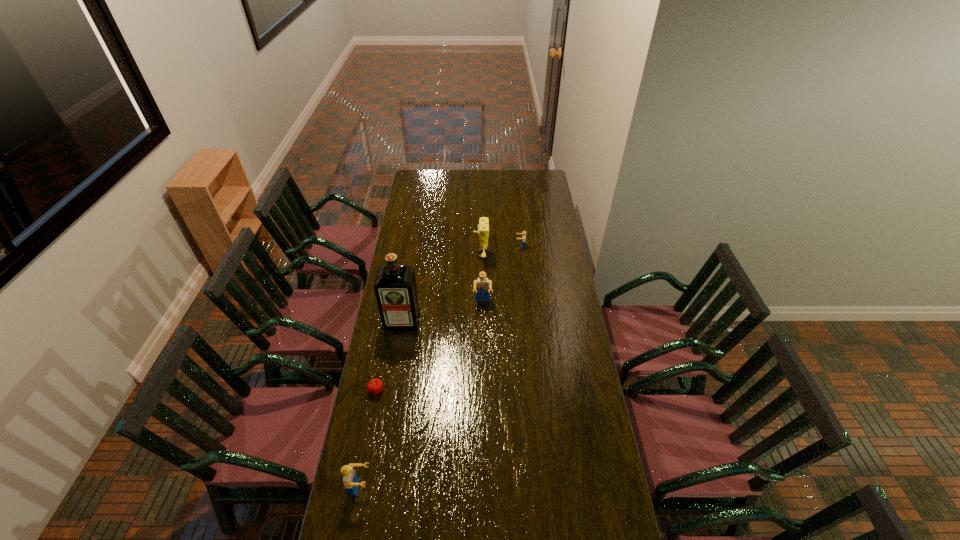
Locate an element on the screen. This screenshot has width=960, height=540. free space between the fourth tallest object and the second tallest object is located at coordinates (420, 371).

Locate an element on the screen. This screenshot has height=540, width=960. free space between the third nearest object and the fifth farthest object is located at coordinates (389, 355).

Where is `vacant point located between the rightmost Lego and the cherry`? This screenshot has height=540, width=960. vacant point located between the rightmost Lego and the cherry is located at coordinates (448, 318).

Locate an element on the screen. The width and height of the screenshot is (960, 540). empty location between the second nearest object and the second farthest Lego is located at coordinates (429, 347).

Locate an element on the screen. vacant space that is in between the second nearest object and the second tallest object is located at coordinates (428, 322).

Where is `empty space that is in between the sponge and the nearest Lego`? empty space that is in between the sponge and the nearest Lego is located at coordinates (420, 371).

Locate an element on the screen. free point between the shortest Lego and the liquor is located at coordinates (462, 283).

Identify the location of object that is the fourth closest to the second farthest Lego. Image resolution: width=960 pixels, height=540 pixels. (375, 386).

Identify the location of the second closest object to the farthest Lego. (482, 285).

You are a GUI agent. You are given a task and a screenshot of the screen. Output one action in this format:
    pyautogui.click(x=<x>, y=<y>)
    Task: Click on the closest Lego to the cherry
    This screenshot has width=960, height=540.
    Given the screenshot: What is the action you would take?
    pyautogui.click(x=351, y=481)